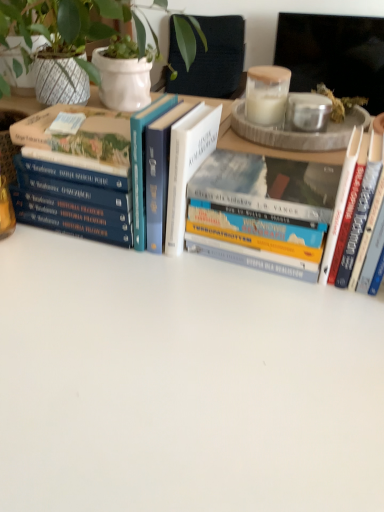
Question: Does point (196, 175) appear closer or farther from the camera than point (28, 155)?

Choices:
 (A) farther
 (B) closer

Answer: (B)

Question: From a real-world perspective, is hardcover book at center, which ranks as the second book in right-to-left order, above or below hardcover book at left, which is the third book in right-to-left order?

Choices:
 (A) below
 (B) above

Answer: (A)

Question: Which object is positioned farthest from the hardcover book at left, acting as the first book starting from the left?

Choices:
 (A) hardcover book at right, which is the 3th book from left to right
 (B) hardcover book at center, which ranks as the second book in right-to-left order

Answer: (A)

Question: Considering the real-world distances, which object is closest to the hardcover book at right, which appears as the 1th book when viewed from the right?

Choices:
 (A) hardcover book at left, which is the third book in right-to-left order
 (B) hardcover book at center, which ranks as the second book in right-to-left order

Answer: (B)